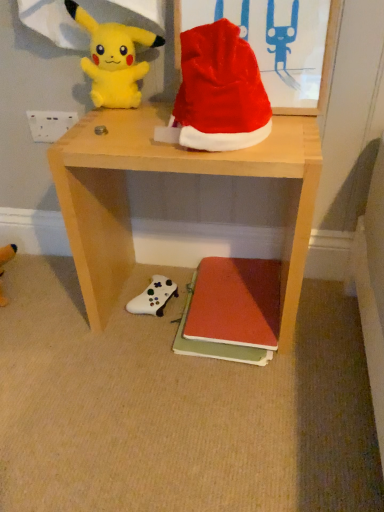
At what (x,y) coordinates should I click in order to perform the action: click on blank space above wooden desk at center (from a real-world perspective). Please return your answer as a coordinate pair (x, y). Looking at the image, I should click on (190, 140).